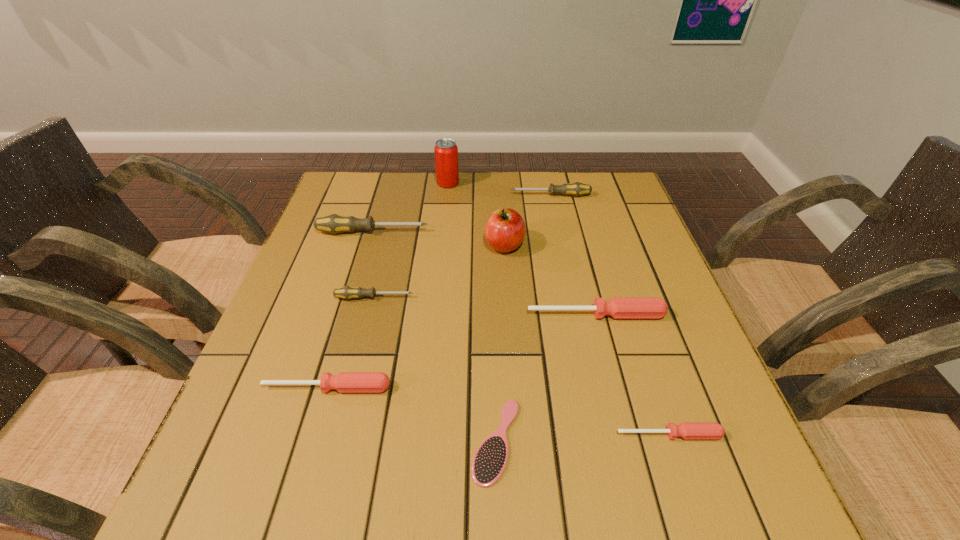
The image size is (960, 540). Identify the location of the leftmost red screwdriver. (345, 382).

The height and width of the screenshot is (540, 960). Identify the location of the second nearest red screwdriver. (345, 382).

This screenshot has height=540, width=960. What are the coordinates of `the fifth farthest object` in the screenshot? It's located at (347, 292).

I want to click on the nearest gray screwdriver, so click(347, 292).

You are a GUI agent. You are given a task and a screenshot of the screen. Output one action in this format:
    pyautogui.click(x=<x>, y=<y>)
    Task: Click on the smallest red screwdriver
    
    Given the screenshot: What is the action you would take?
    pyautogui.click(x=687, y=430)

The image size is (960, 540). Find the location of `the second shortest object`. the second shortest object is located at coordinates (687, 430).

Locate an element on the screen. Image resolution: width=960 pixels, height=540 pixels. hairbrush is located at coordinates (489, 462).

Where is `free region located 0.170m on the front of the tallest object`? Image resolution: width=960 pixels, height=540 pixels. free region located 0.170m on the front of the tallest object is located at coordinates (444, 222).

You are a GUI agent. You are given a task and a screenshot of the screen. Output one action in this format:
    pyautogui.click(x=<x>, y=<y>)
    Task: Click on the vacant space positioned 0.140m on the back of the eighth shortest object
    
    Given the screenshot: What is the action you would take?
    pyautogui.click(x=502, y=203)

Where is `vacant area situated at the tip of the second farthest screwdriver`? This screenshot has width=960, height=540. vacant area situated at the tip of the second farthest screwdriver is located at coordinates (492, 232).